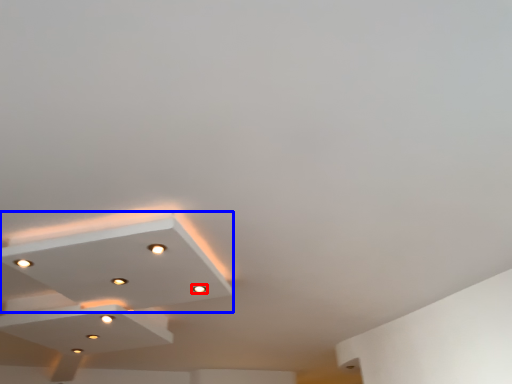
Question: Which of the following is the closest to the observer, light (highlighted by a red box) or lamp (highlighted by a blue box)?

Choices:
 (A) light
 (B) lamp

Answer: (B)